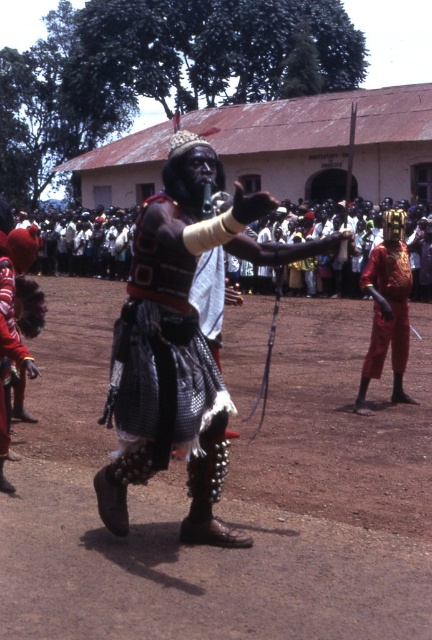
Does textured fabric skirt at center have a greater width compared to red fabric skirt at lower left?

Indeed, textured fabric skirt at center has a greater width compared to red fabric skirt at lower left.

Who is taller, textured fabric skirt at center or red fabric skirt at lower left?

textured fabric skirt at center is taller.

The width and height of the screenshot is (432, 640). In order to click on textured fabric skirt at center in this screenshot , I will do `click(177, 342)`.

Locate an element on the screen. This screenshot has height=640, width=432. textured fabric skirt at center is located at coordinates (177, 342).

Is point (120, 326) farther from viewer compared to point (118, 342)?

Yes, point (120, 326) is farther from viewer.

Locate an element on the screen. The width and height of the screenshot is (432, 640). textured fabric skirt at center is located at coordinates (177, 342).

Does point (171, 444) come closer to viewer compared to point (190, 310)?

Yes.

I want to click on textured fabric skirt at center, so click(x=177, y=342).

Who is lower down, brown dirt field at center or shiny gold armor at right?

Positioned lower is brown dirt field at center.

Between brown dirt field at center and shiny gold armor at right, which one appears on the right side from the viewer's perspective?

shiny gold armor at right is more to the right.

Locate an element on the screen. The image size is (432, 640). brown dirt field at center is located at coordinates (224, 499).